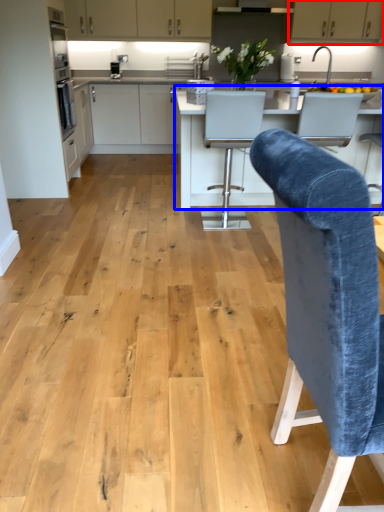
Question: Which point is further to the camera, cabinetry (highlighted by a red box) or countertop (highlighted by a blue box)?

Choices:
 (A) cabinetry
 (B) countertop

Answer: (A)